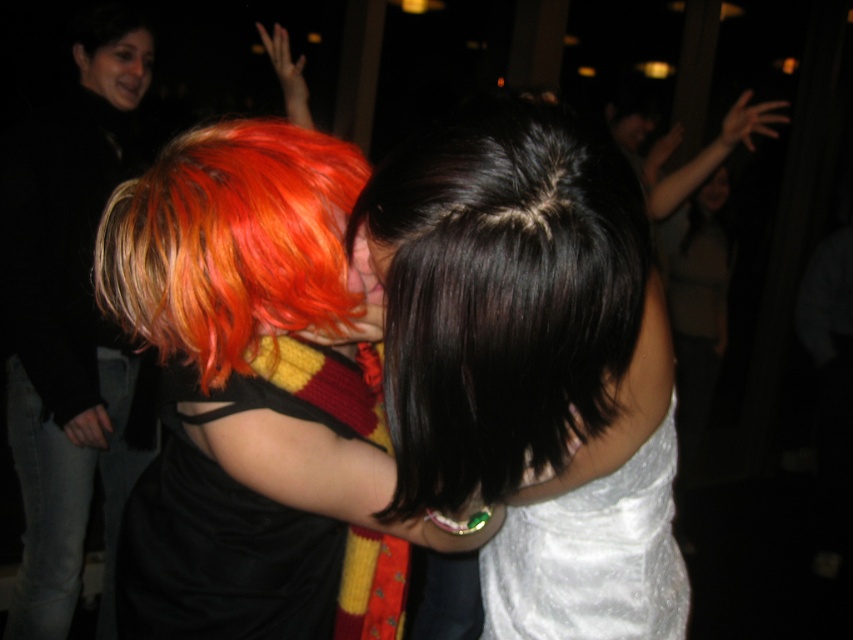
You are a photographer adjusting the camera focus. The shiny black hair at center and the white satin dress at center are both in your frame. If the camera can only focus on one object at a time, which object should you focus on to ensure the other is still in the depth of field?

Since the shiny black hair at center is only 1.73 inches away from the white satin dress at center, focusing on either object would likely keep both within the depth of field due to their close proximity.

You are standing in the middle of the room and want to move towards both the point at coordinates (x=184, y=134) and the point at (x=579, y=496). Which point will you reach first?

You will reach the point at coordinates (x=184, y=134) first because it is closer to you than the point at (x=579, y=496).